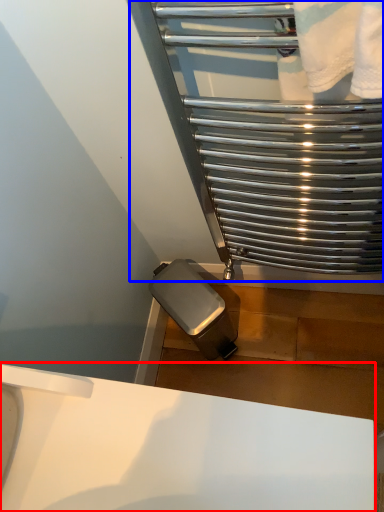
Question: Which object is closer to the camera taking this photo, sink (highlighted by a red box) or glass door (highlighted by a blue box)?

Choices:
 (A) sink
 (B) glass door

Answer: (A)